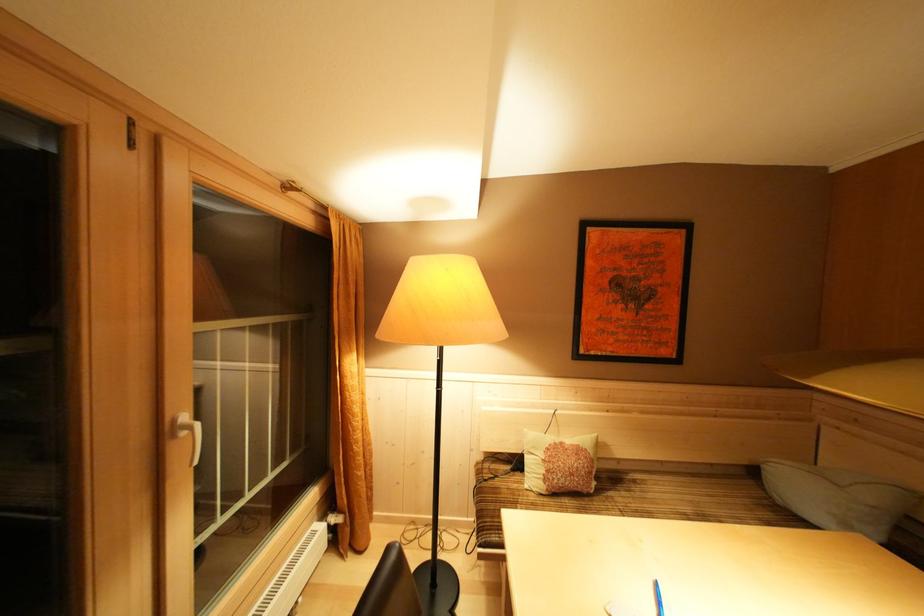
You are a GUI agent. You are given a task and a screenshot of the screen. Output one action in this format:
    pyautogui.click(x=<x>, y=<y>)
    Task: Click on the orange curtain
    
    Given the screenshot: What is the action you would take?
    pyautogui.click(x=348, y=387)